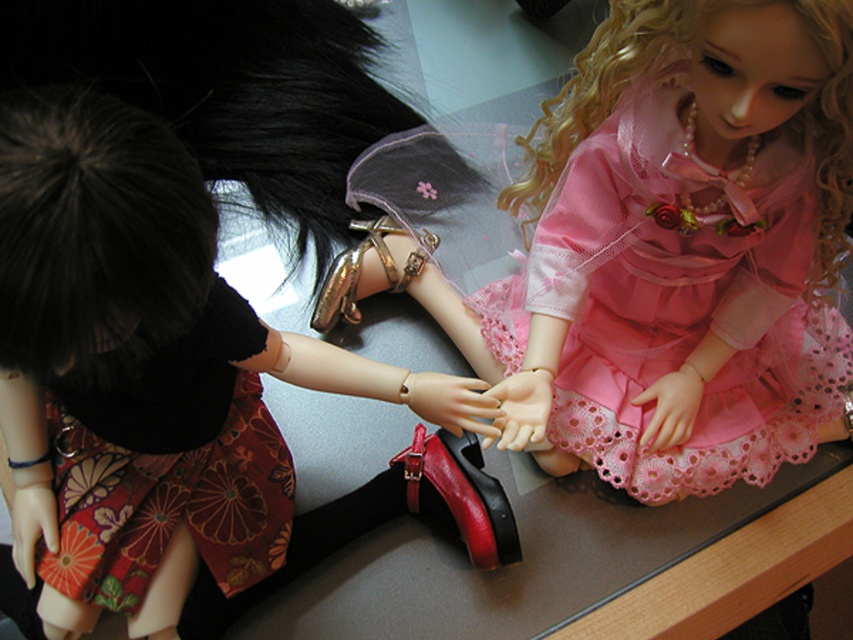
Who is positioned more to the right, floral silk skirt at lower left or shiny red leather shoe at center?

From the viewer's perspective, shiny red leather shoe at center appears more on the right side.

Can you confirm if floral silk skirt at lower left is thinner than shiny red leather shoe at center?

Incorrect, floral silk skirt at lower left's width is not less than shiny red leather shoe at center's.

Which is behind, point (112, 435) or point (426, 502)?

Positioned behind is point (426, 502).

Where is `floral silk skirt at lower left`? The width and height of the screenshot is (853, 640). floral silk skirt at lower left is located at coordinates (171, 467).

Who is more distant from viewer, (x=111, y=148) or (x=567, y=364)?

The point (x=567, y=364) is more distant.

Does matte black doll at center appear under pink lace dress at upper right?

Yes.

Who is more forward, (x=218, y=342) or (x=651, y=202)?

Positioned in front is point (x=218, y=342).

Identify the location of matte black doll at center. (154, 388).

Does pink lace dress at upper right appear over shiny red leather shoe at center?

Yes, pink lace dress at upper right is above shiny red leather shoe at center.

Between pink lace dress at upper right and shiny red leather shoe at center, which one is positioned higher?

pink lace dress at upper right is higher up.

Who is more distant from viewer, (767,141) or (392,460)?

The point (392,460) is behind.

You are a GUI agent. You are given a task and a screenshot of the screen. Output one action in this format:
    pyautogui.click(x=<x>, y=<y>)
    Task: Click on the pink lace dress at upper right
    
    Given the screenshot: What is the action you would take?
    click(x=677, y=301)